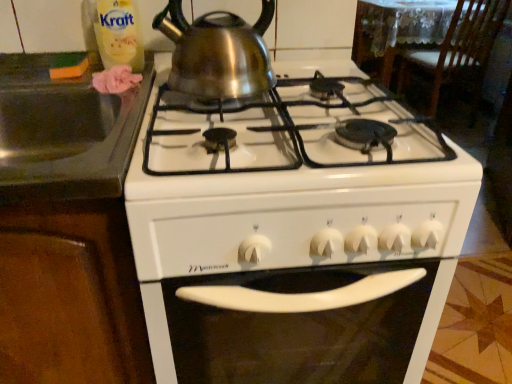
Question: Does point (249, 86) appear closer or farther from the camera than point (121, 38)?

Choices:
 (A) farther
 (B) closer

Answer: (B)

Question: Looking at their shapes, would you say shiny metallic kettle at upper center is wider or thinner than translucent plastic bottle at upper left?

Choices:
 (A) wide
 (B) thin

Answer: (A)

Question: Estimate the real-world distances between objects in this image. Which object is closer to the shiny metallic kettle at upper center?

Choices:
 (A) white glossy gas stove at center
 (B) black granite sink at left
 (C) translucent plastic bottle at upper left
 (D) wooden chair at upper right

Answer: (C)

Question: Estimate the real-world distances between objects in this image. Which object is farther from the wooden chair at upper right?

Choices:
 (A) black granite sink at left
 (B) white glossy gas stove at center
 (C) translucent plastic bottle at upper left
 (D) shiny metallic kettle at upper center

Answer: (C)